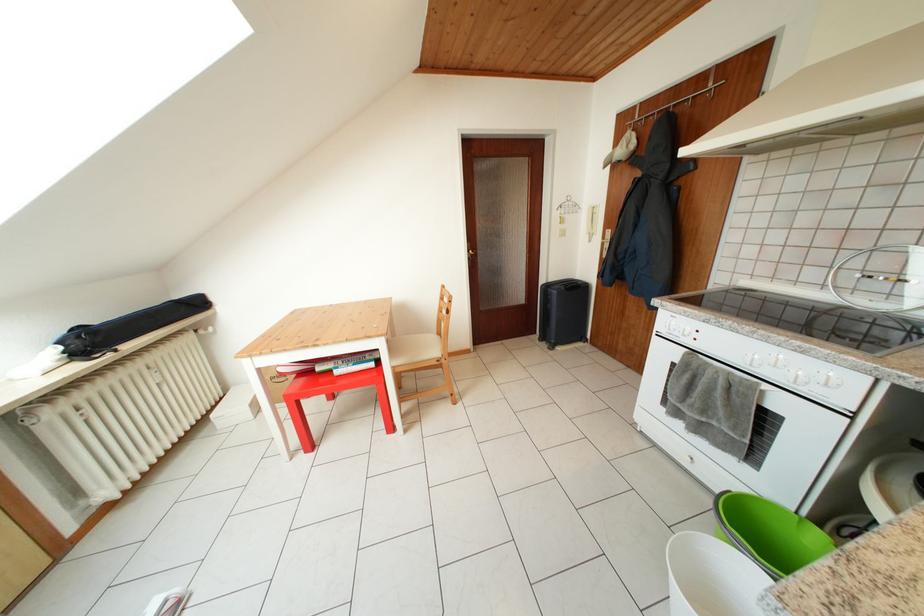
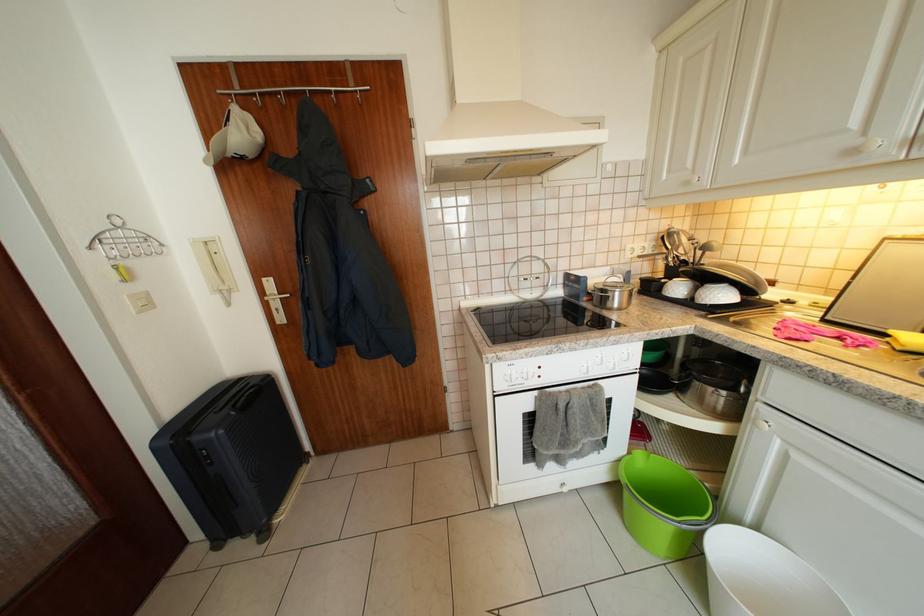
In the second image, find the point that corresponds to the point at 828,540 in the first image.

(648, 459)